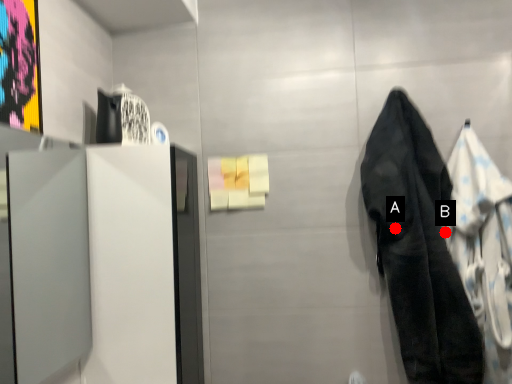
Question: Two points are circled on the image, labeled by A and B beside each circle. Which point appears closest to the camera in this image?

Choices:
 (A) A is closer
 (B) B is closer

Answer: (B)